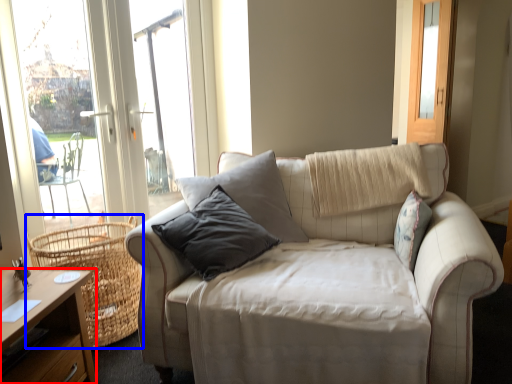
Question: Which point is further to the camera, desk (highlighted by a red box) or basket (highlighted by a blue box)?

Choices:
 (A) desk
 (B) basket

Answer: (B)